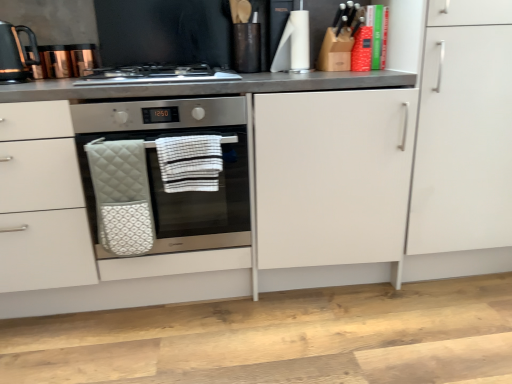
In order to face white matte cabinet at right, should I rotate leftwards or rightwards?

Rotate right and turn 24.483 degrees.

In order to click on quilted white oven mitt at center, which is the 1th hand towel in left-to-right order in this screenshot , I will do `click(121, 195)`.

Choose the correct answer: Is white striped fabric hand towel at center, placed as the 2th hand towel when sorted from left to right, inside satin silver oven at center or outside it?

white striped fabric hand towel at center, placed as the 2th hand towel when sorted from left to right, fits inside satin silver oven at center.

Consider the image. Which of these two, white striped fabric hand towel at center, arranged as the first hand towel when viewed from the right, or satin silver oven at center, is wider?

satin silver oven at center.

From a real-world perspective, between white striped fabric hand towel at center, arranged as the first hand towel when viewed from the right, and satin silver oven at center, who is vertically higher?

white striped fabric hand towel at center, arranged as the first hand towel when viewed from the right.

You are a GUI agent. You are given a task and a screenshot of the screen. Output one action in this format:
    pyautogui.click(x=<x>, y=<y>)
    Task: Click on the hand towel on the right of satin silver oven at center
    Image resolution: width=512 pixels, height=384 pixels.
    Given the screenshot: What is the action you would take?
    pyautogui.click(x=190, y=163)

From the image's perspective, is satin silver oven at center located above or below stainless steel gas stove at center?

satin silver oven at center is situated lower than stainless steel gas stove at center in the image.

Considering the sizes of satin silver oven at center and stainless steel gas stove at center in the image, is satin silver oven at center taller or shorter than stainless steel gas stove at center?

satin silver oven at center is taller than stainless steel gas stove at center.

Would you say satin silver oven at center is to the left or to the right of stainless steel gas stove at center in the picture?

Based on their positions, satin silver oven at center is located to the right of stainless steel gas stove at center.

Consider the image. Would you say white matte cabinet at right is to the left or to the right of quilted white oven mitt at center, arranged as the 2th hand towel when viewed from the right, in the picture?

white matte cabinet at right is positioned on quilted white oven mitt at center, arranged as the 2th hand towel when viewed from the right,'s right side.

Considering the relative sizes of white matte cabinet at right and quilted white oven mitt at center, which is the 1th hand towel in left-to-right order, in the image provided, is white matte cabinet at right thinner than quilted white oven mitt at center, which is the 1th hand towel in left-to-right order,?

No.

From the image's perspective, who appears lower, white matte cabinet at right or quilted white oven mitt at center, arranged as the 2th hand towel when viewed from the right?

quilted white oven mitt at center, arranged as the 2th hand towel when viewed from the right, from the image's perspective.

Is white matte cabinet at right positioned with its back to quilted white oven mitt at center, arranged as the 2th hand towel when viewed from the right?

No, white matte cabinet at right is not facing the opposite direction of quilted white oven mitt at center, arranged as the 2th hand towel when viewed from the right.

Who is taller, satin silver oven at center or white matte cabinet at right?

white matte cabinet at right.

Does satin silver oven at center turn towards white matte cabinet at right?

No, satin silver oven at center is not aimed at white matte cabinet at right.

Between satin silver oven at center and white matte cabinet at right, which one has smaller size?

satin silver oven at center is smaller.

From the image's perspective, who appears lower, satin silver oven at center or white matte cabinet at right?

satin silver oven at center.

Which object is wider, white matte cabinet at right or black glossy kettle at upper left?

With larger width is white matte cabinet at right.

From a real-world perspective, which object rests below the other?

From a 3D spatial view, white matte cabinet at right is below.

Measure the distance from white matte cabinet at right to black glossy kettle at upper left.

They are 5.38 feet apart.

Can you tell me how much white matte cabinet at right and black glossy kettle at upper left differ in facing direction?

0.000179 degrees separate the facing orientations of white matte cabinet at right and black glossy kettle at upper left.

Consider the image. Which is closer, (141, 152) or (203, 188)?

Clearly, point (141, 152) is closer to the camera than point (203, 188).

Would you say quilted white oven mitt at center, arranged as the 2th hand towel when viewed from the right, is to the left or to the right of white striped fabric hand towel at center, placed as the 2th hand towel when sorted from left to right, in the picture?

Clearly, quilted white oven mitt at center, arranged as the 2th hand towel when viewed from the right, is on the left of white striped fabric hand towel at center, placed as the 2th hand towel when sorted from left to right, in the image.

Is there a large distance between quilted white oven mitt at center, which is the 1th hand towel in left-to-right order, and white striped fabric hand towel at center, placed as the 2th hand towel when sorted from left to right?

No, quilted white oven mitt at center, which is the 1th hand towel in left-to-right order, is not far from white striped fabric hand towel at center, placed as the 2th hand towel when sorted from left to right.

How different are the orientations of quilted white oven mitt at center, which is the 1th hand towel in left-to-right order, and white striped fabric hand towel at center, arranged as the first hand towel when viewed from the right, in degrees?

There is a 0.000115-degree angle between the facing directions of quilted white oven mitt at center, which is the 1th hand towel in left-to-right order, and white striped fabric hand towel at center, arranged as the first hand towel when viewed from the right.

Can you confirm if white striped fabric hand towel at center, arranged as the first hand towel when viewed from the right, is thinner than quilted white oven mitt at center, arranged as the 2th hand towel when viewed from the right?

In fact, white striped fabric hand towel at center, arranged as the first hand towel when viewed from the right, might be wider than quilted white oven mitt at center, arranged as the 2th hand towel when viewed from the right.

Would you say white striped fabric hand towel at center, arranged as the first hand towel when viewed from the right, is outside quilted white oven mitt at center, arranged as the 2th hand towel when viewed from the right?

Yes, white striped fabric hand towel at center, arranged as the first hand towel when viewed from the right, is located beyond the bounds of quilted white oven mitt at center, arranged as the 2th hand towel when viewed from the right.

Based on their positions, is white striped fabric hand towel at center, placed as the 2th hand towel when sorted from left to right, located to the left or right of quilted white oven mitt at center, arranged as the 2th hand towel when viewed from the right?

white striped fabric hand towel at center, placed as the 2th hand towel when sorted from left to right, is to the right of quilted white oven mitt at center, arranged as the 2th hand towel when viewed from the right.

From a real-world perspective, between white striped fabric hand towel at center, placed as the 2th hand towel when sorted from left to right, and quilted white oven mitt at center, which is the 1th hand towel in left-to-right order, who is vertically lower?

quilted white oven mitt at center, which is the 1th hand towel in left-to-right order, is physically lower.

Find the location of a particular element. oven above the white striped fabric hand towel at center, placed as the 2th hand towel when sorted from left to right (from the image's perspective) is located at coordinates (161, 200).

Locate an element on the screen. This screenshot has height=384, width=512. oven located on the right of stainless steel gas stove at center is located at coordinates (161, 200).

Estimate the real-world distances between objects in this image. Which object is closer to white striped fabric hand towel at center, arranged as the first hand towel when viewed from the right, quilted white oven mitt at center, which is the 1th hand towel in left-to-right order, or white matte cabinet at right?

Based on the image, quilted white oven mitt at center, which is the 1th hand towel in left-to-right order, appears to be nearer to white striped fabric hand towel at center, arranged as the first hand towel when viewed from the right.

From the image, which object appears to be farther from white striped fabric hand towel at center, placed as the 2th hand towel when sorted from left to right, satin silver oven at center or stainless steel gas stove at center?

The object further to white striped fabric hand towel at center, placed as the 2th hand towel when sorted from left to right, is stainless steel gas stove at center.

When comparing their distances from white striped fabric hand towel at center, placed as the 2th hand towel when sorted from left to right, does quilted white oven mitt at center, which is the 1th hand towel in left-to-right order, or black glossy kettle at upper left seem closer?

quilted white oven mitt at center, which is the 1th hand towel in left-to-right order, lies closer to white striped fabric hand towel at center, placed as the 2th hand towel when sorted from left to right, than the other object.

Considering their positions, is quilted white oven mitt at center, arranged as the 2th hand towel when viewed from the right, positioned closer to stainless steel gas stove at center than white matte cabinet at right?

quilted white oven mitt at center, arranged as the 2th hand towel when viewed from the right, is closer to stainless steel gas stove at center.

Estimate the real-world distances between objects in this image. Which object is closer to white matte cabinet at right, stainless steel gas stove at center or quilted white oven mitt at center, which is the 1th hand towel in left-to-right order?

stainless steel gas stove at center is closer to white matte cabinet at right.

Considering their positions, is stainless steel gas stove at center positioned further to quilted white oven mitt at center, arranged as the 2th hand towel when viewed from the right, than black glossy kettle at upper left?

Among the two, black glossy kettle at upper left is located further to quilted white oven mitt at center, arranged as the 2th hand towel when viewed from the right.

Considering their positions, is stainless steel gas stove at center positioned closer to quilted white oven mitt at center, arranged as the 2th hand towel when viewed from the right, than white matte cabinet at right?

stainless steel gas stove at center.

When comparing their distances from quilted white oven mitt at center, which is the 1th hand towel in left-to-right order, does stainless steel gas stove at center or white striped fabric hand towel at center, arranged as the first hand towel when viewed from the right, seem closer?

Based on the image, white striped fabric hand towel at center, arranged as the first hand towel when viewed from the right, appears to be nearer to quilted white oven mitt at center, which is the 1th hand towel in left-to-right order.

I want to click on gas stove between black glossy kettle at upper left and quilted white oven mitt at center, arranged as the 2th hand towel when viewed from the right, from top to bottom, so click(x=155, y=75).

Identify the location of hand towel between stainless steel gas stove at center and white matte cabinet at right. (190, 163).

Locate an element on the screen. The height and width of the screenshot is (384, 512). hand towel between black glossy kettle at upper left and white striped fabric hand towel at center, placed as the 2th hand towel when sorted from left to right, in the horizontal direction is located at coordinates (121, 195).

Where is `oven between stainless steel gas stove at center and white matte cabinet at right from left to right`? The width and height of the screenshot is (512, 384). oven between stainless steel gas stove at center and white matte cabinet at right from left to right is located at coordinates (161, 200).